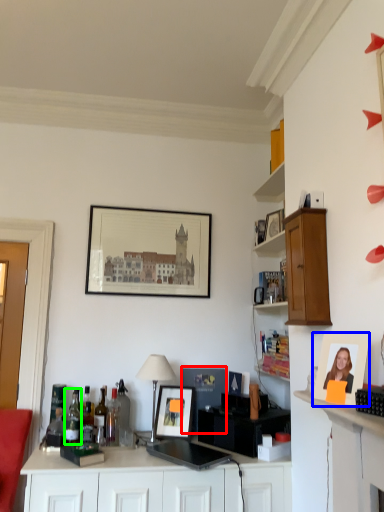
Question: Which object is positioned farthest from picture frame (highlighted by a red box)? Select from picture frame (highlighted by a blue box) and bottle (highlighted by a green box).

Choices:
 (A) picture frame
 (B) bottle

Answer: (A)